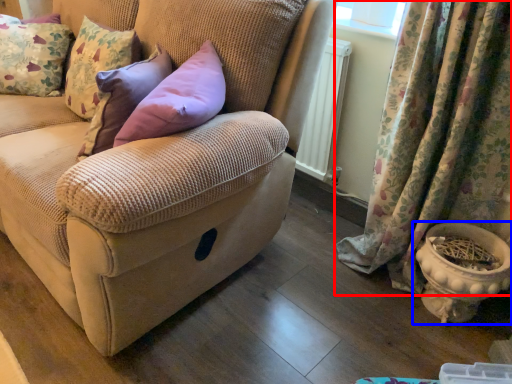
Question: Which object is further to the camera taking this photo, curtain (highlighted by a red box) or flowerpot (highlighted by a blue box)?

Choices:
 (A) curtain
 (B) flowerpot

Answer: (B)